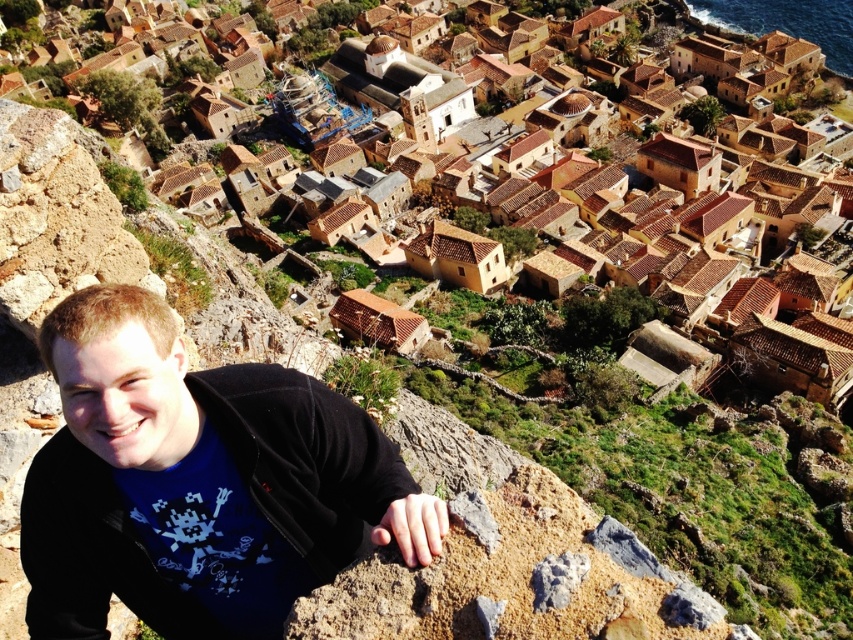
You are a photographer aiming to capture the village scene while ensuring the black matte jacket at lower left is visible in the frame. Where exactly should you position the jacket in the image?

The black matte jacket at lower left should be positioned at point (x=196, y=483) to ensure it is visible in the frame.

You are a photographer trying to capture the village in the distance while also including the person in the foreground. Based on the scene, where should you position the black matte jacket at lower left relative to the brown clay village at lower left to ensure both are in frame?

The black matte jacket at lower left is already positioned to the left of the brown clay village at lower left, so you can frame the shot by placing the jacket on the left side and the village on the right side within the same frame.